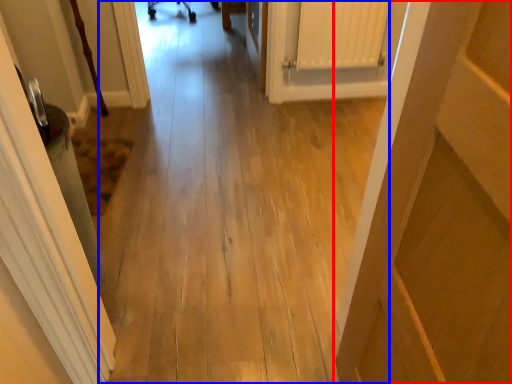
Question: Which point is closer to the camera, door (highlighted by a red box) or path (highlighted by a blue box)?

Choices:
 (A) door
 (B) path

Answer: (A)